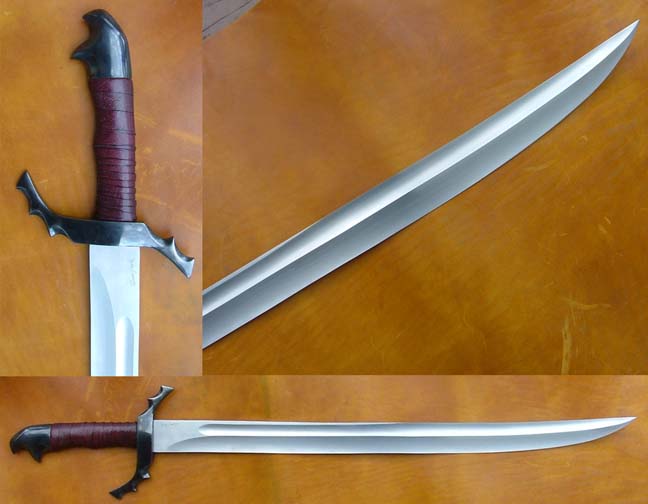
Locate an element on the screen. This screenshot has width=648, height=504. surface is located at coordinates (321, 131).